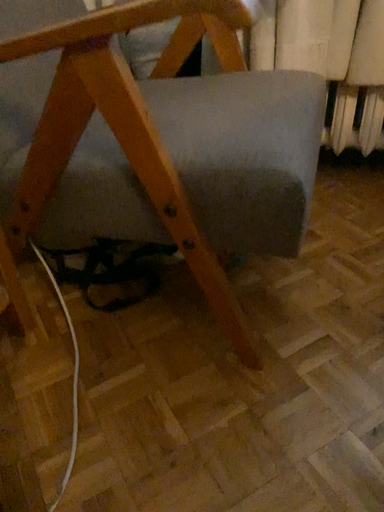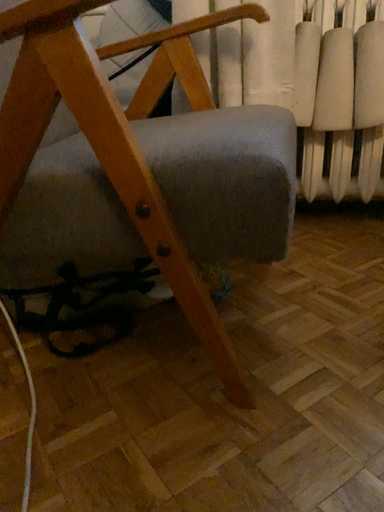
Question: Which way did the camera rotate in the video?

Choices:
 (A) rotated upward
 (B) rotated downward

Answer: (A)